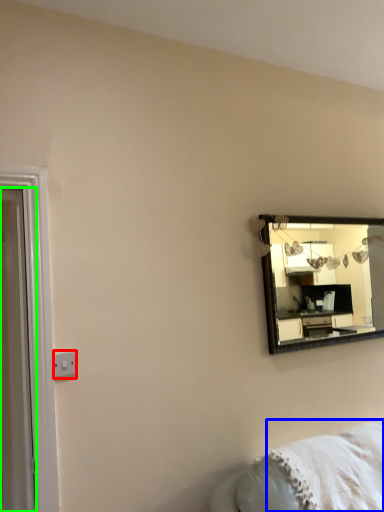
Question: Which object is the farthest from electric outlet (highlighted by a red box)? Choose among these: blanket (highlighted by a blue box) or door (highlighted by a green box).

Choices:
 (A) blanket
 (B) door

Answer: (A)